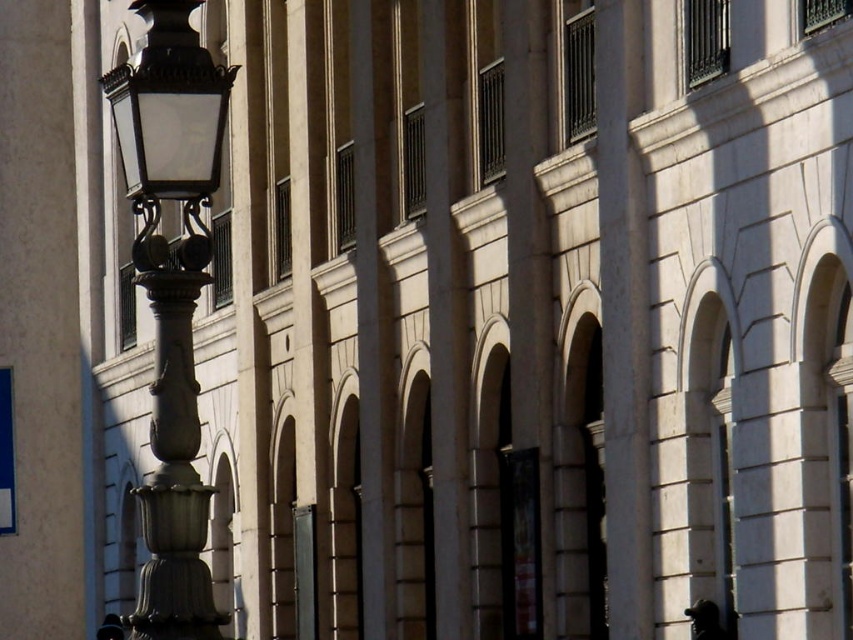
Is point (163, 580) closer to viewer compared to point (715, 627)?

That is True.

Can you confirm if polished brass streetlight at left is positioned above black glossy statue at lower right?

Correct, polished brass streetlight at left is located above black glossy statue at lower right.

Does point (221, 92) lie in front of point (705, 637)?

Yes, point (221, 92) is in front of point (705, 637).

The height and width of the screenshot is (640, 853). I want to click on polished brass streetlight at left, so click(171, 296).

Does black glossy statue at lower right appear over smooth black hat at lower left?

Indeed, black glossy statue at lower right is positioned over smooth black hat at lower left.

Is black glossy statue at lower right bigger than smooth black hat at lower left?

No.

Image resolution: width=853 pixels, height=640 pixels. Identify the location of black glossy statue at lower right. (706, 620).

Consider the image. Who is higher up, polished brass streetlight at left or smooth black hat at lower left?

Positioned higher is polished brass streetlight at left.

I want to click on polished brass streetlight at left, so click(171, 296).

Image resolution: width=853 pixels, height=640 pixels. I want to click on polished brass streetlight at left, so click(171, 296).